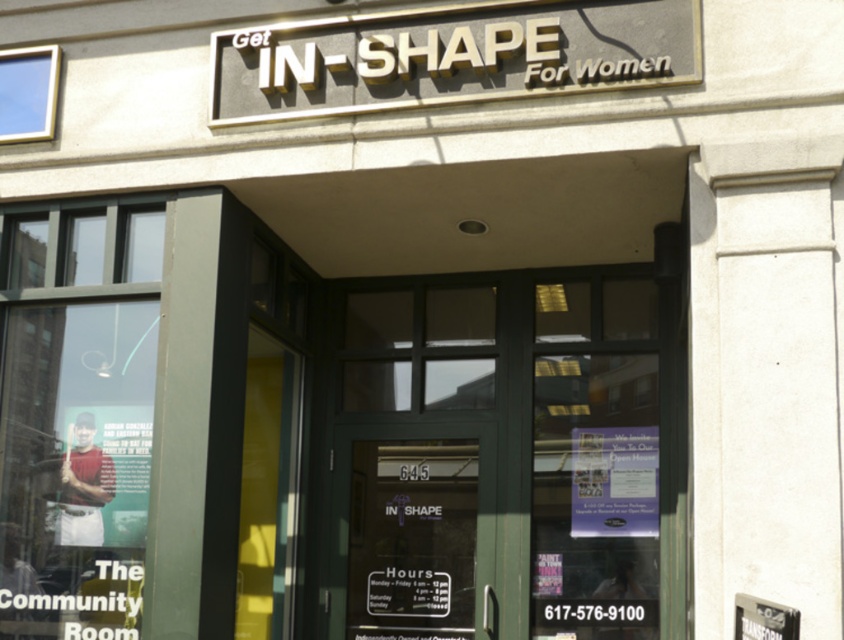
Question: Based on their relative distances, which object is nearer to the matte paper flyer at center?

Choices:
 (A) gold metallic sign at upper center
 (B) green glass door at center

Answer: (B)

Question: Which point appears closest to the camera in this image?

Choices:
 (A) (419, 465)
 (B) (458, 81)
 (C) (604, 496)

Answer: (B)

Question: Can you confirm if green glass door at center is positioned to the right of matte paper flyer at center?

Choices:
 (A) yes
 (B) no

Answer: (B)

Question: Is green glass door at center thinner than matte paper flyer at center?

Choices:
 (A) no
 (B) yes

Answer: (A)

Question: From the image, what is the correct spatial relationship of gold metallic sign at upper center in relation to green glass door at center?

Choices:
 (A) above
 (B) below

Answer: (A)

Question: Which point is farther to the camera?

Choices:
 (A) (574, 472)
 (B) (625, 10)

Answer: (A)